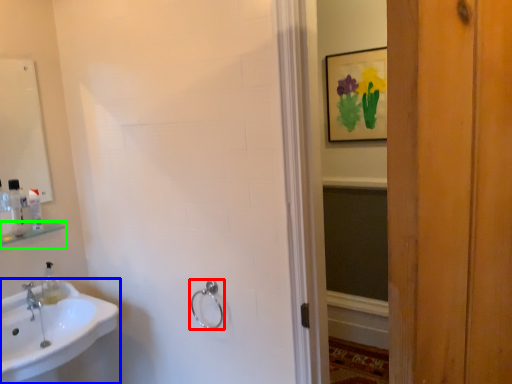
Question: Based on their relative distances, which object is farther from towel rack (highlighted by a red box)? Choose from sink (highlighted by a blue box) and shelf (highlighted by a green box).

Choices:
 (A) sink
 (B) shelf

Answer: (B)